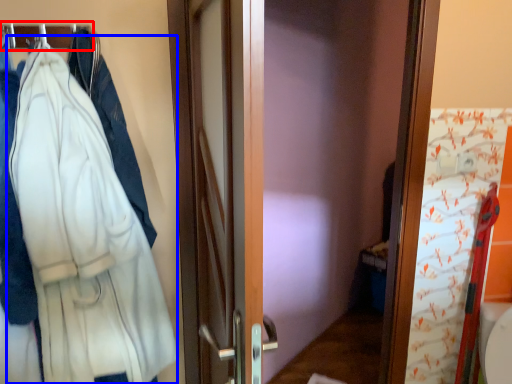
Question: Which point is further to the camera, hanger (highlighted by a red box) or bathrobe (highlighted by a blue box)?

Choices:
 (A) hanger
 (B) bathrobe

Answer: (A)